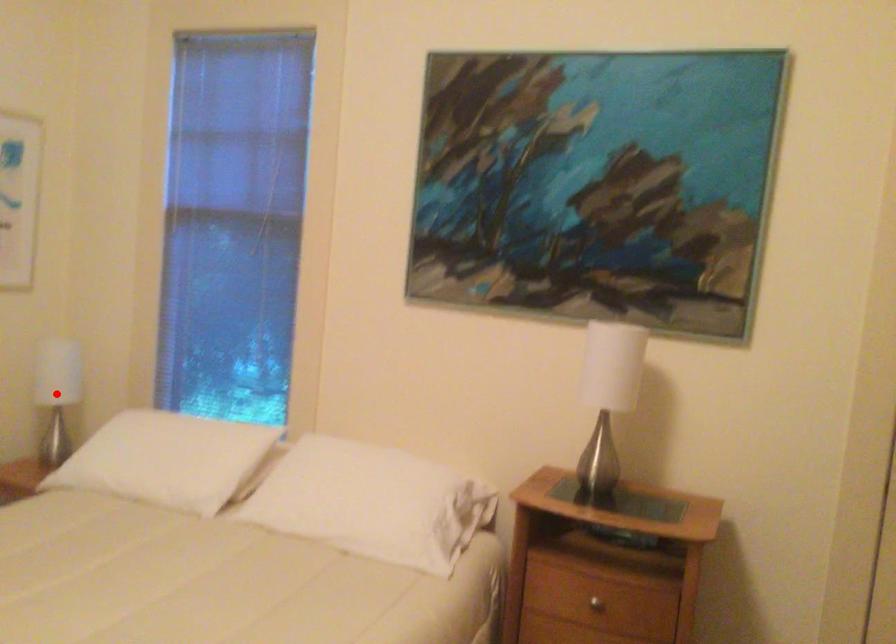
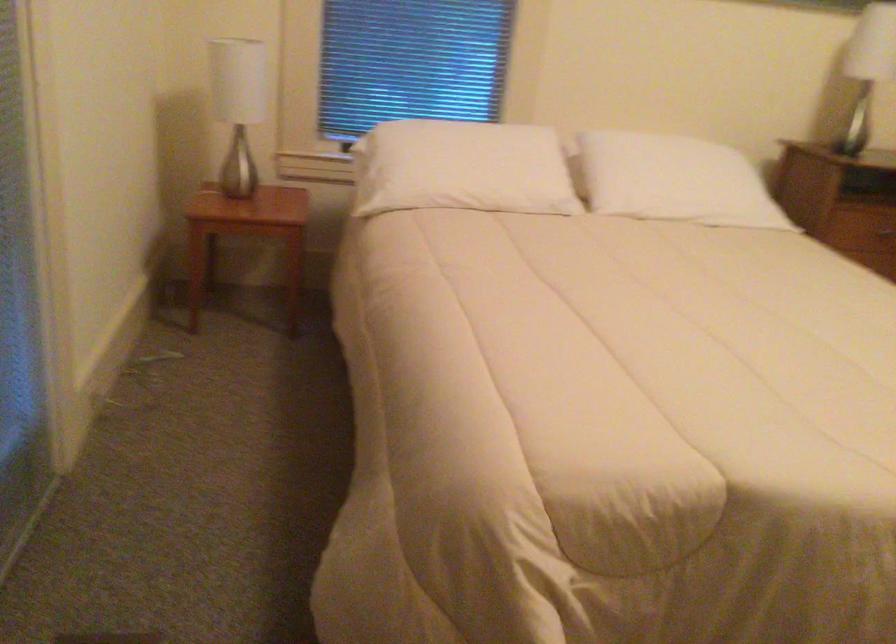
Question: I am providing you with two images of the same scene from different viewpoints. A red point is marked on the first image. Is the red point's position out of view in image 2?

Choices:
 (A) Yes
 (B) No

Answer: (A)